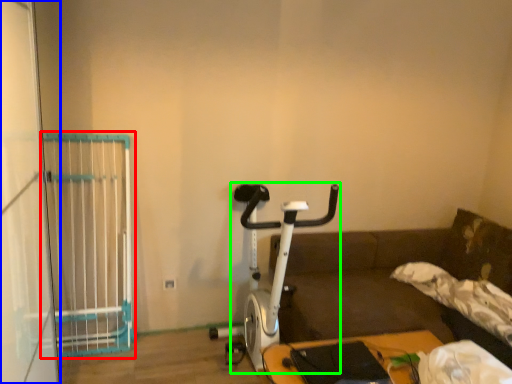
Question: Which object is the closest to the cage (highlighted by a red box)? Choose among these: screen door (highlighted by a blue box) or stationary bicycle (highlighted by a green box).

Choices:
 (A) screen door
 (B) stationary bicycle

Answer: (A)